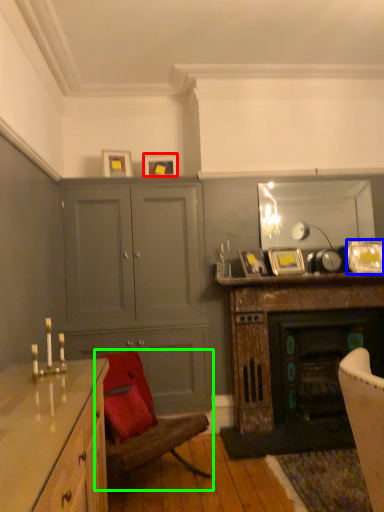
Question: Which is nearer to the picture frame (highlighted by a red box)? picture frame (highlighted by a blue box) or chair (highlighted by a green box).

Choices:
 (A) picture frame
 (B) chair

Answer: (A)